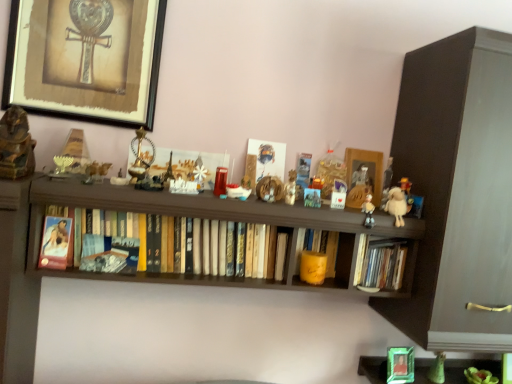
Image resolution: width=512 pixels, height=384 pixels. I want to click on matte paper photo frame at left, so click(55, 243).

Image resolution: width=512 pixels, height=384 pixels. What do you see at coordinates (383, 265) in the screenshot?
I see `hardcover book at center, acting as the first book starting from the right` at bounding box center [383, 265].

At what (x,y) coordinates should I click in order to perform the action: click on fluffy beige stuffed animal at right. Please return your answer as a coordinate pair (x, y). This screenshot has width=512, height=384. Looking at the image, I should click on (396, 205).

Image resolution: width=512 pixels, height=384 pixels. What do you see at coordinates (170, 325) in the screenshot?
I see `brown wooden shelf at center` at bounding box center [170, 325].

The image size is (512, 384). Describe the element at coordinates (458, 191) in the screenshot. I see `dark wood cabinet at right` at that location.

What is the approximate width of dark wood cabinet at right?

It is 16.50 inches.

How much space does wooden picture frame at center, the second picture frame in the left-to-right sequence, occupy vertically?

wooden picture frame at center, the second picture frame in the left-to-right sequence, is 7.60 inches tall.

Image resolution: width=512 pixels, height=384 pixels. In order to click on matte paper photo frame at left in this screenshot , I will do `click(55, 243)`.

Which is further, (82,377) or (223,276)?

The point (82,377) is more distant.

Is brown wooden shelf at center looking in the opposite direction of hardcover books at center, the 1th book positioned from the left?

Absolutely, brown wooden shelf at center is directed away from hardcover books at center, the 1th book positioned from the left.

Which object is more forward, brown wooden shelf at center or hardcover books at center, the 1th book positioned from the left?

hardcover books at center, the 1th book positioned from the left, is more forward.

Considering the sizes of objects brown wooden shelf at center and hardcover books at center, the 1th book positioned from the left, in the image provided, who is smaller, brown wooden shelf at center or hardcover books at center, the 1th book positioned from the left,?

hardcover books at center, the 1th book positioned from the left.

Where is `paperback book on the left side of wooden picture frame at center, which ranks as the first picture frame in right-to-left order`? The height and width of the screenshot is (384, 512). paperback book on the left side of wooden picture frame at center, which ranks as the first picture frame in right-to-left order is located at coordinates (55, 243).

Is wooden picture frame at center, acting as the second picture frame starting from the top, situated inside matte paper photo frame at left or outside?

wooden picture frame at center, acting as the second picture frame starting from the top, lies outside matte paper photo frame at left.

Considering the points (346, 203) and (67, 245), which point is behind, point (346, 203) or point (67, 245)?

Positioned behind is point (346, 203).

From the image's perspective, between wooden picture frame at center, the 2th picture frame when ordered from front to back, and matte paper photo frame at left, who is located below?

matte paper photo frame at left, from the image's perspective.

Considering the sizes of objects matte paper photo frame at left and hardcover book at center, acting as the first book starting from the right, in the image provided, who is taller, matte paper photo frame at left or hardcover book at center, acting as the first book starting from the right,?

hardcover book at center, acting as the first book starting from the right.

Does matte paper photo frame at left have a greater width compared to hardcover book at center, acting as the first book starting from the right?

In fact, matte paper photo frame at left might be narrower than hardcover book at center, acting as the first book starting from the right.

From the picture: Considering the sizes of objects brown wooden shelf at center and dark wood cabinet at right in the image provided, who is thinner, brown wooden shelf at center or dark wood cabinet at right?

Thinner between the two is brown wooden shelf at center.

Between brown wooden shelf at center and dark wood cabinet at right, which one is positioned behind?

Positioned behind is brown wooden shelf at center.

Between point (137, 363) and point (462, 314), which one is positioned in front?

The point (462, 314) is closer to the camera.

Is hardcover books at center, the 1th book positioned from the left, in front of or behind fluffy beige stuffed animal at right in the image?

hardcover books at center, the 1th book positioned from the left, is positioned closer to the viewer than fluffy beige stuffed animal at right.

From a real-world perspective, between hardcover books at center, which is the third book from right to left, and fluffy beige stuffed animal at right, who is vertically lower?

From a 3D spatial view, hardcover books at center, which is the third book from right to left, is below.

How distant is hardcover books at center, which is the third book from right to left, from fluffy beige stuffed animal at right?

hardcover books at center, which is the third book from right to left, is 15.98 inches from fluffy beige stuffed animal at right.

Can you confirm if hardcover books at center, which is the third book from right to left, is bigger than fluffy beige stuffed animal at right?

Yes, hardcover books at center, which is the third book from right to left, is bigger than fluffy beige stuffed animal at right.

From the image's perspective, which object appears higher, yellow matte candle at center, which is counted as the 2th book, starting from the left, or hardcover book at center, acting as the third book starting from the left?

yellow matte candle at center, which is counted as the 2th book, starting from the left, from the image's perspective.

Locate an element on the screen. This screenshot has width=512, height=384. book located on the right of yellow matte candle at center, which is counted as the 2th book, starting from the right is located at coordinates (383, 265).

Measure the distance from yellow matte candle at center, which is counted as the 2th book, starting from the left, to hardcover book at center, acting as the third book starting from the left.

yellow matte candle at center, which is counted as the 2th book, starting from the left, and hardcover book at center, acting as the third book starting from the left, are 6.08 inches apart.

Is the position of yellow matte candle at center, which is counted as the 2th book, starting from the left, less distant than that of hardcover book at center, acting as the third book starting from the left?

No, the depth of yellow matte candle at center, which is counted as the 2th book, starting from the left, is greater than that of hardcover book at center, acting as the third book starting from the left.

From the image's perspective, is metallic framed artwork at upper left, the first picture frame viewed from the front, positioned above or below fluffy beige stuffed animal at right?

metallic framed artwork at upper left, the first picture frame viewed from the front, is situated higher than fluffy beige stuffed animal at right in the image.

At what (x,y) coordinates should I click in order to perform the action: click on animal that is under the metallic framed artwork at upper left, the first picture frame viewed from the front (from a real-world perspective). Please return your answer as a coordinate pair (x, y). Looking at the image, I should click on (396, 205).

Looking at this image, is metallic framed artwork at upper left, positioned as the 1th picture frame in top-to-bottom order, directly adjacent to fluffy beige stuffed animal at right?

metallic framed artwork at upper left, positioned as the 1th picture frame in top-to-bottom order, is not next to fluffy beige stuffed animal at right, and they're not touching.

At what (x,y) coordinates should I click in order to perform the action: click on book to the left of brown wooden shelf at center. Please return your answer as a coordinate pair (x, y). This screenshot has width=512, height=384. Looking at the image, I should click on pos(250,254).

This screenshot has width=512, height=384. In order to click on paperback book lying in front of the wooden picture frame at center, which appears as the first picture frame when ordered from the bottom in this screenshot , I will do `click(55, 243)`.

Looking at the image, which one is located further to dark wood cabinet at right, metallic framed artwork at upper left, which is counted as the first picture frame, starting from the left, or hardcover books at center, which is the third book from right to left?

Among the two, metallic framed artwork at upper left, which is counted as the first picture frame, starting from the left, is located further to dark wood cabinet at right.

Estimate the real-world distances between objects in this image. Which object is further from matte paper photo frame at left, dark wood cabinet at right or wooden picture frame at center, the 2th picture frame when ordered from front to back?

Based on the image, dark wood cabinet at right appears to be further to matte paper photo frame at left.

Looking at the image, which one is located closer to matte paper photo frame at left, hardcover books at center, which is the third book from right to left, or brown wooden shelf at center?

hardcover books at center, which is the third book from right to left, lies closer to matte paper photo frame at left than the other object.

From the image, which object appears to be nearer to wooden picture frame at center, which ranks as the first picture frame in right-to-left order, matte paper photo frame at left or hardcover book at center, acting as the first book starting from the right?

The object closer to wooden picture frame at center, which ranks as the first picture frame in right-to-left order, is hardcover book at center, acting as the first book starting from the right.

When comparing their distances from yellow matte candle at center, which is counted as the 2th book, starting from the right, does brown wooden shelf at center or hardcover book at center, acting as the third book starting from the left, seem closer?

hardcover book at center, acting as the third book starting from the left, lies closer to yellow matte candle at center, which is counted as the 2th book, starting from the right, than the other object.

Estimate the real-world distances between objects in this image. Which object is closer to matte paper photo frame at left, wooden picture frame at center, the second picture frame in the left-to-right sequence, or dark wood cabinet at right?

wooden picture frame at center, the second picture frame in the left-to-right sequence, lies closer to matte paper photo frame at left than the other object.

Estimate the real-world distances between objects in this image. Which object is further from brown wooden shelf at center, hardcover book at center, acting as the first book starting from the right, or yellow matte candle at center, which is counted as the 2th book, starting from the right?

The object further to brown wooden shelf at center is hardcover book at center, acting as the first book starting from the right.

Which object lies nearer to the anchor point wooden picture frame at center, the second picture frame in the left-to-right sequence, hardcover books at center, the 1th book positioned from the left, or metallic framed artwork at upper left, positioned as the 1th picture frame in top-to-bottom order?

Based on the image, hardcover books at center, the 1th book positioned from the left, appears to be nearer to wooden picture frame at center, the second picture frame in the left-to-right sequence.

Locate an element on the screen. picture frame between hardcover books at center, the 1th book positioned from the left, and dark wood cabinet at right is located at coordinates (367, 175).

The width and height of the screenshot is (512, 384). Identify the location of picture frame between yellow matte candle at center, which is counted as the 2th book, starting from the left, and dark wood cabinet at right. (367, 175).

Find the location of a particular element. This screenshot has width=512, height=384. shelf between metallic framed artwork at upper left, the first picture frame viewed from the front, and fluffy beige stuffed animal at right from left to right is located at coordinates (170, 325).

Identify the location of picture frame located between matte paper photo frame at left and wooden picture frame at center, acting as the second picture frame starting from the top, in the left-right direction. This screenshot has height=384, width=512. (85, 59).